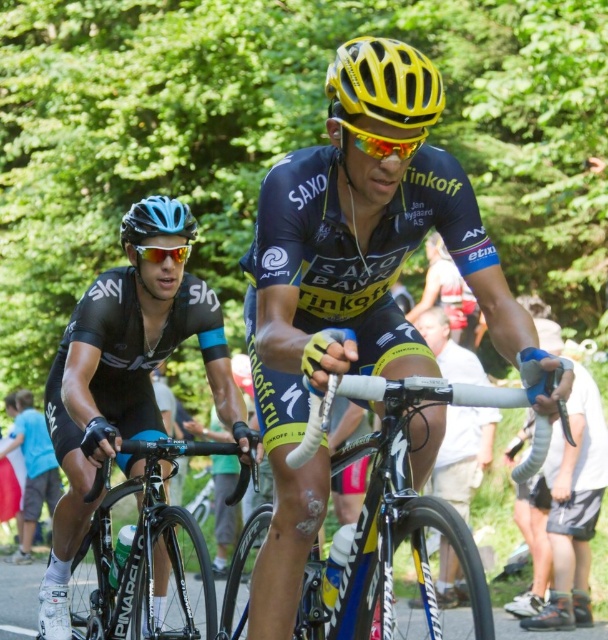
You are a photographer at the cycling race. You need to capture a photo where the black matte cycling jersey at left is visible above the shiny orange lens at center. Is this possible given their current positions?

The black matte cycling jersey at left is located below the shiny orange lens at center, so it would not be visible above it in the current arrangement.

You are a photographer at the cycling race and want to capture a closeup of the yellow matte bicycle handlebar at center and the shiny orange lens at center. Which object should you zoom in more on to ensure both are in focus?

The yellow matte bicycle handlebar at center is thinner than the shiny orange lens at center, so you should zoom in more on the shiny orange lens at center to ensure both are in focus.